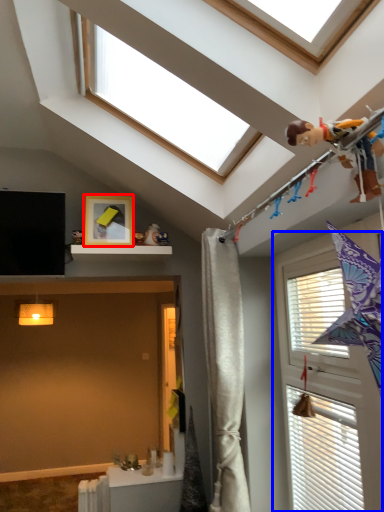
Question: Among these objects, which one is farthest to the camera, picture frame (highlighted by a red box) or window (highlighted by a blue box)?

Choices:
 (A) picture frame
 (B) window

Answer: (A)